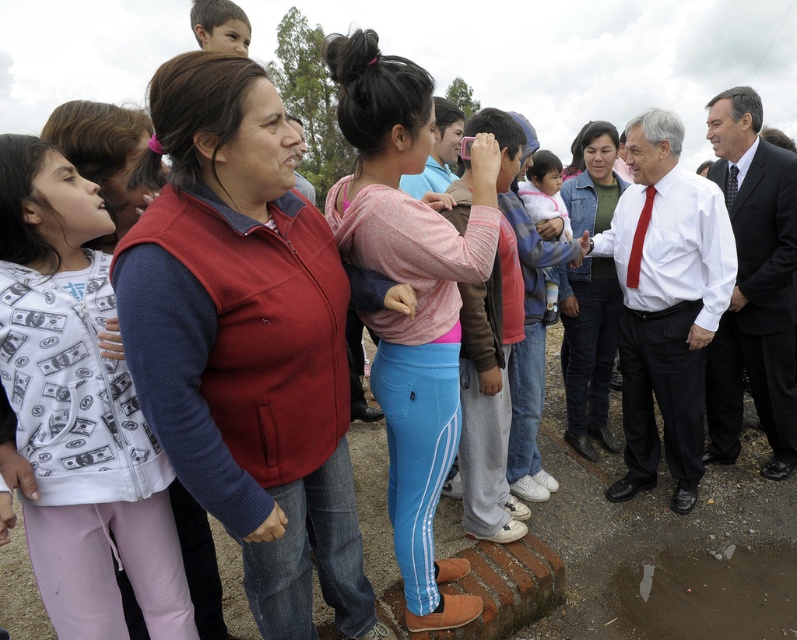
You are trying to decide which clothing item has a larger width when viewed from the front. Based on the image, which one is wider between the pink fabric shirt at center and the dark suit at right?

The pink fabric shirt at center is wider than the dark suit at right according to the description.

You are an observer standing in front of the image. You notice the pink fabric shirt at center and the red silk tie at right. Which of these two items is taller?

The pink fabric shirt at center is taller than the red silk tie at right.

You are standing in the middle of the scene and want to greet both the pink fabric shirt at center and the red silk tie at right. Which person should you approach first if you want to greet the one closer to you?

You should greet the pink fabric shirt at center first because it is in front of the red silk tie at right, meaning it is closer to you.